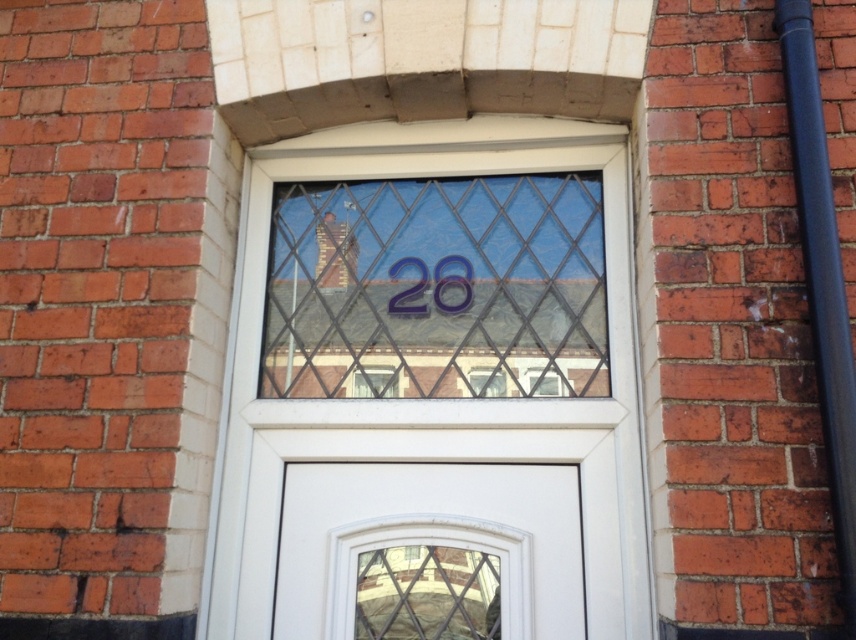
Question: Can you confirm if transparent glass at center is thinner than white glossy door at center?

Choices:
 (A) yes
 (B) no

Answer: (B)

Question: Is transparent glass at center smaller than matte plastic number at center?

Choices:
 (A) yes
 (B) no

Answer: (B)

Question: Which object is closer to the camera taking this photo?

Choices:
 (A) white glossy door at center
 (B) transparent glass at center

Answer: (A)

Question: Does white glossy door at center have a larger size compared to matte plastic number at center?

Choices:
 (A) no
 (B) yes

Answer: (B)

Question: Which object appears farthest from the camera in this image?

Choices:
 (A) transparent glass at center
 (B) white glossy door at center
 (C) matte plastic number at center

Answer: (C)

Question: Estimate the real-world distances between objects in this image. Which object is closer to the transparent glass at center?

Choices:
 (A) matte plastic number at center
 (B) white glossy door at center

Answer: (A)